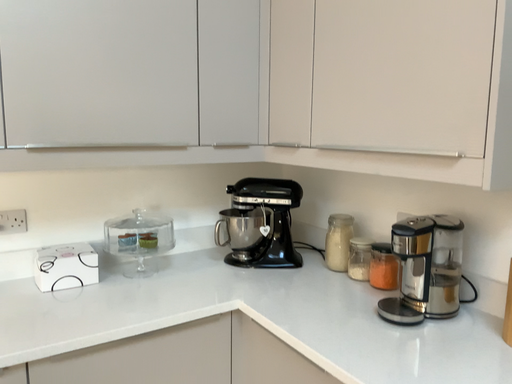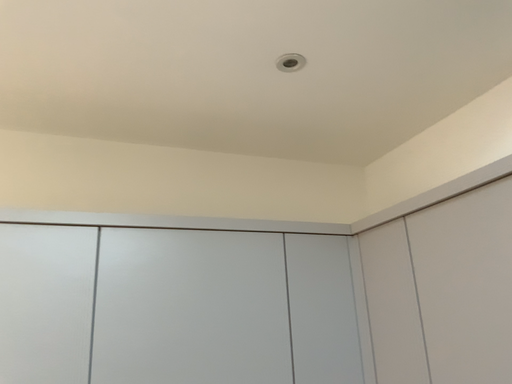
Question: How did the camera likely rotate when shooting the video?

Choices:
 (A) rotated upward
 (B) rotated downward

Answer: (A)